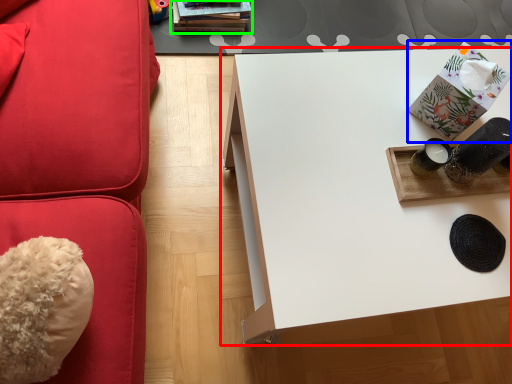
Question: Which is farther away from table (highlighted by a red box)? package (highlighted by a blue box) or book (highlighted by a green box)?

Choices:
 (A) package
 (B) book

Answer: (B)